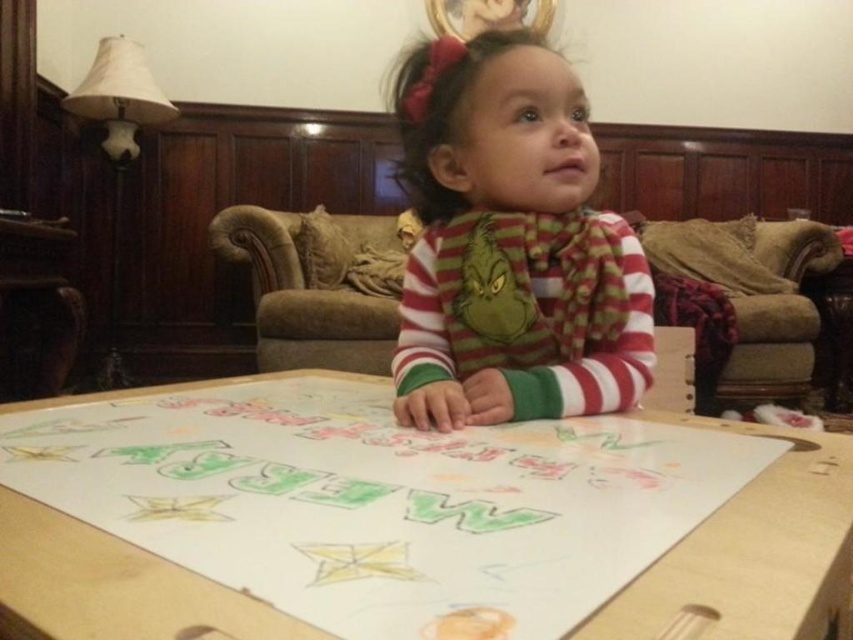
Question: Which point is farther to the camera?

Choices:
 (A) striped cotton shirt at center
 (B) wooden table at center

Answer: (A)

Question: Which object is closer to the camera taking this photo?

Choices:
 (A) striped cotton shirt at center
 (B) wooden table at center

Answer: (B)

Question: Does wooden table at center appear on the left side of striped cotton shirt at center?

Choices:
 (A) no
 (B) yes

Answer: (B)

Question: Is wooden table at center closer to camera compared to striped cotton shirt at center?

Choices:
 (A) no
 (B) yes

Answer: (B)

Question: Does wooden table at center appear over striped cotton shirt at center?

Choices:
 (A) no
 (B) yes

Answer: (A)

Question: Which object is closer to the camera taking this photo?

Choices:
 (A) wooden table at center
 (B) striped cotton shirt at center

Answer: (A)